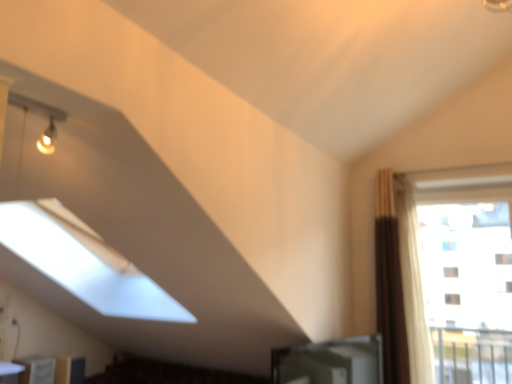
Question: Does point 7,379 appear closer or farther from the camera than point 44,370?

Choices:
 (A) closer
 (B) farther

Answer: (A)

Question: In terms of height, does white glossy table at lower left look taller or shorter compared to white glossy bookshelf at lower left, placed as the first furniture when sorted from front to back?

Choices:
 (A) tall
 (B) short

Answer: (B)

Question: Estimate the real-world distances between objects in this image. Which object is farther from the transparent glass window at right?

Choices:
 (A) white glossy table at lower left
 (B) white glossy bookshelf at lower left, placed as the first furniture when sorted from front to back
 (C) matte wood cabinet at lower left, acting as the first furniture starting from the back
 (D) brown fabric curtain at right

Answer: (A)

Question: Which is nearer to the transparent glass window at right?

Choices:
 (A) white glossy bookshelf at lower left, placed as the first furniture when sorted from front to back
 (B) brown fabric curtain at right
 (C) matte wood cabinet at lower left, acting as the first furniture starting from the back
 (D) white glossy table at lower left

Answer: (B)